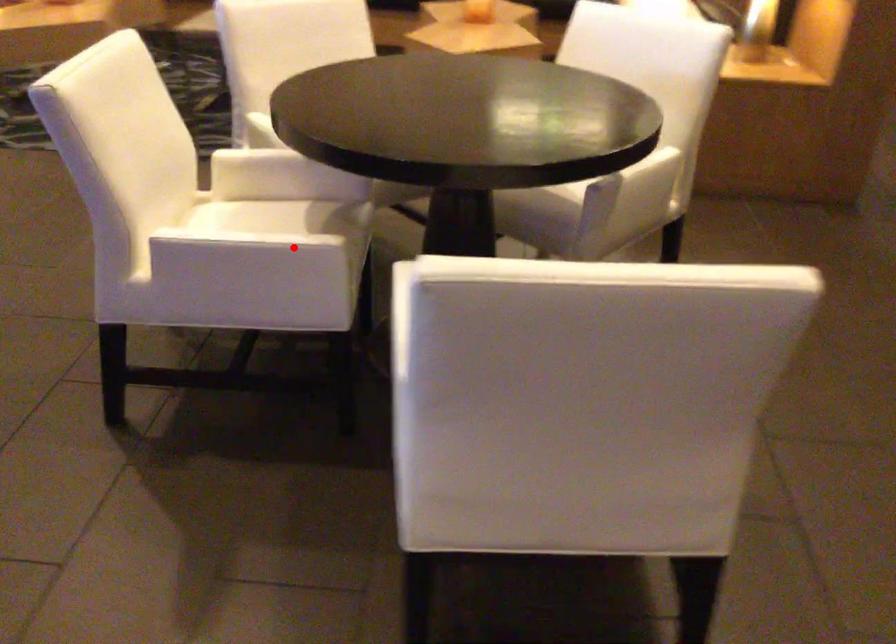
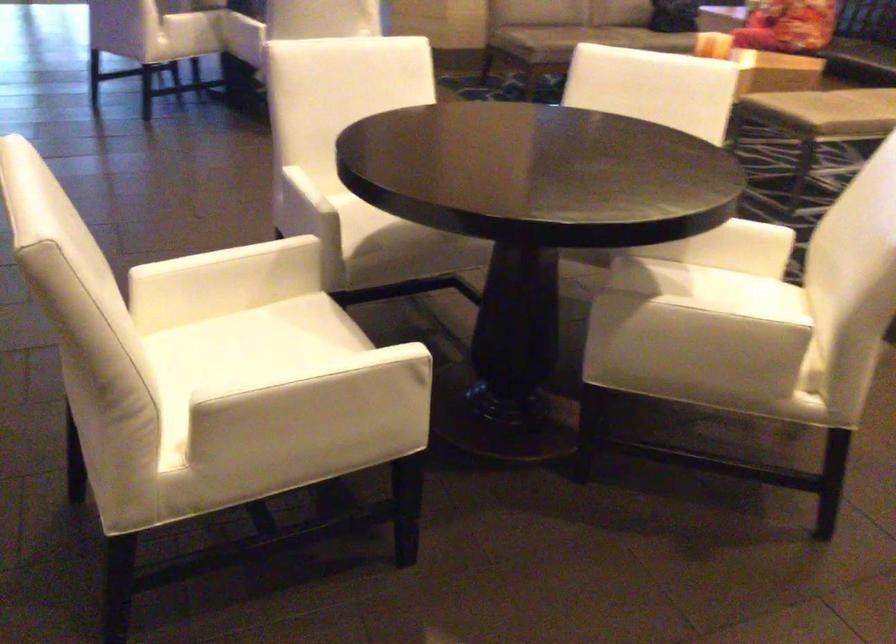
The point at the highlighted location is marked in the first image. Where is the corresponding point in the second image?

(372, 223)